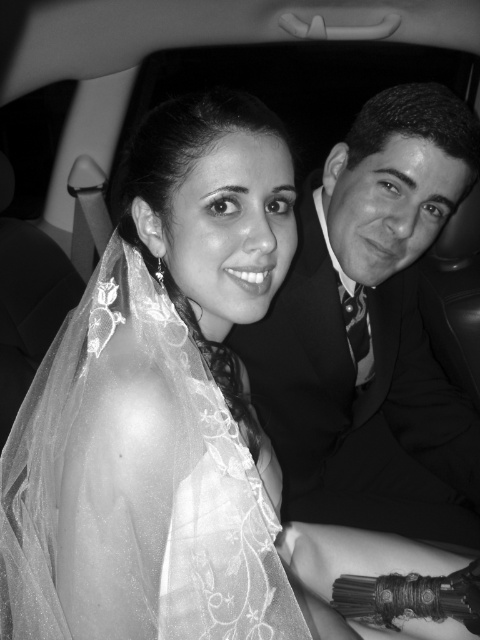
Question: Can you confirm if translucent lace veil at upper left is positioned to the right of smooth black suit at right?

Choices:
 (A) yes
 (B) no

Answer: (B)

Question: Does translucent lace veil at upper left come behind smooth black suit at right?

Choices:
 (A) yes
 (B) no

Answer: (B)

Question: Which point appears farthest from the camera in this image?

Choices:
 (A) (321, 516)
 (B) (156, 384)

Answer: (A)

Question: Which point appears farthest from the camera in this image?

Choices:
 (A) (352, 508)
 (B) (108, 284)

Answer: (A)

Question: Is the position of translucent lace veil at upper left more distant than that of smooth black suit at right?

Choices:
 (A) yes
 (B) no

Answer: (B)